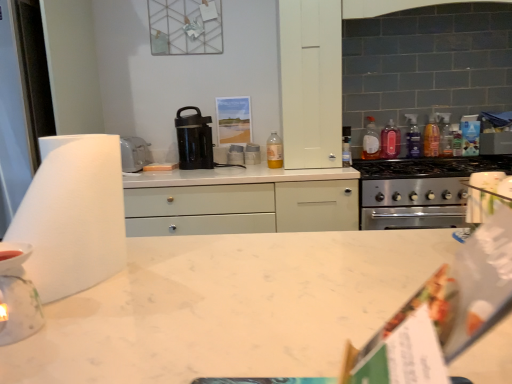
This screenshot has height=384, width=512. What are the coordinates of `vacant location below black plastic coffee maker at center (from a real-world perspective)` in the screenshot? It's located at tap(198, 161).